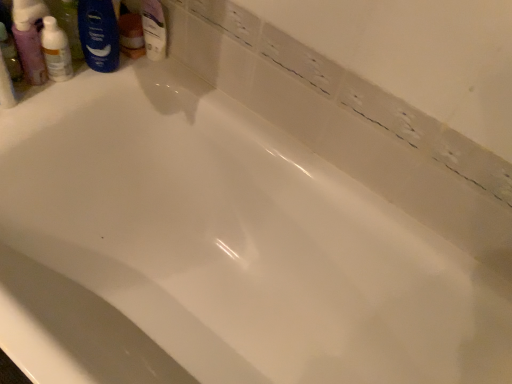
This screenshot has height=384, width=512. I want to click on vacant area to the right of translucent plastic mouthwash at upper left, so click(x=90, y=78).